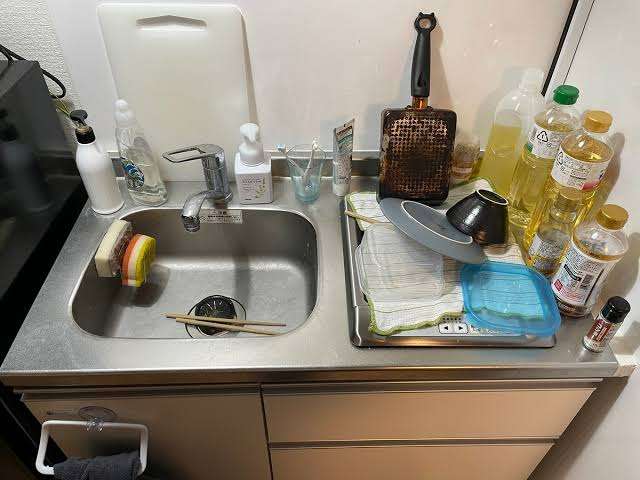
This screenshot has width=640, height=480. I want to click on kitchen sink, so click(x=424, y=23), click(x=269, y=284).